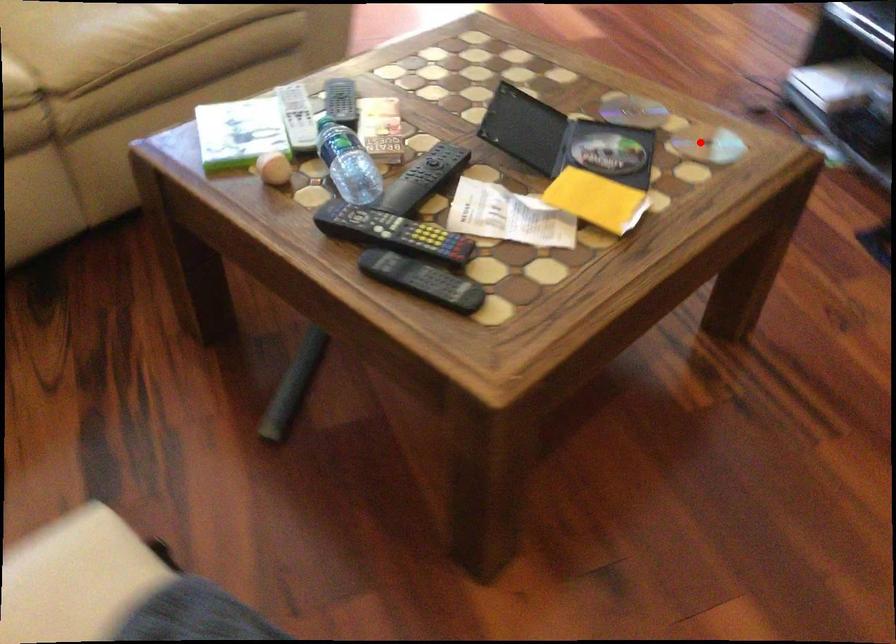
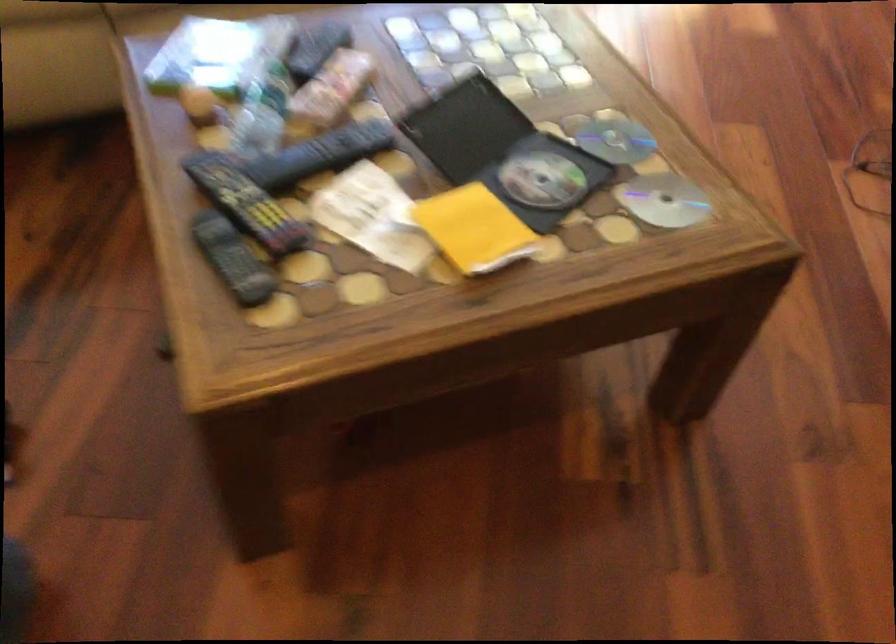
Where in the second image is the point corresponding to the highlighted location from the first image?

(664, 200)